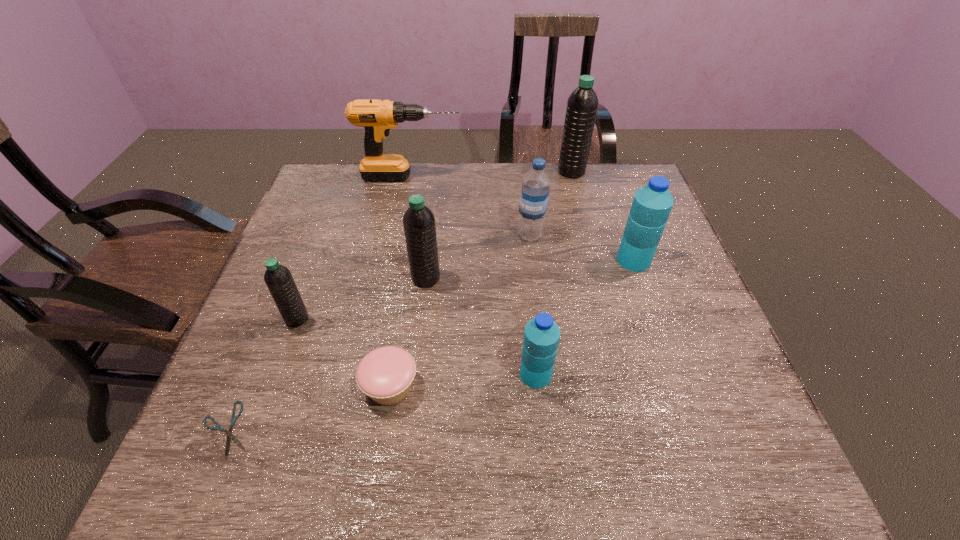
In order to click on the farthest black water bottle in this screenshot , I will do `click(582, 104)`.

This screenshot has height=540, width=960. I want to click on the tallest object, so click(x=582, y=104).

This screenshot has height=540, width=960. In order to click on drill in this screenshot , I will do `click(377, 117)`.

Image resolution: width=960 pixels, height=540 pixels. Identify the location of the fifth water bottle from right to left. (419, 225).

Locate an element on the screen. The width and height of the screenshot is (960, 540). the second nearest black water bottle is located at coordinates (419, 225).

The height and width of the screenshot is (540, 960). In order to click on the rightmost water bottle in this screenshot , I will do `click(652, 204)`.

Image resolution: width=960 pixels, height=540 pixels. Identify the location of the second farthest blue water bottle. (652, 204).

Where is `the fifth nearest water bottle`? the fifth nearest water bottle is located at coordinates (535, 190).

Find the location of a particular element. the farthest blue water bottle is located at coordinates (535, 190).

At what (x,y) coordinates should I click in order to perform the action: click on the fourth nearest object. Please return your answer as a coordinate pair (x, y). Looking at the image, I should click on (278, 278).